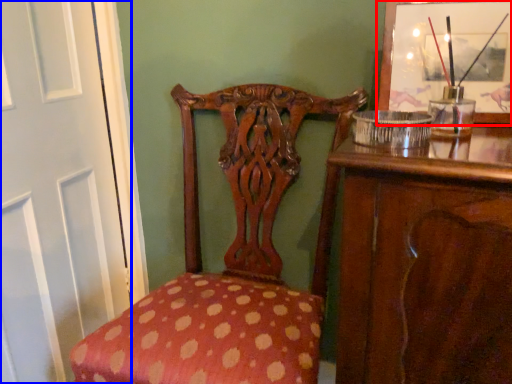
Question: Which point is closer to the camera, picture frame (highlighted by a red box) or screen door (highlighted by a blue box)?

Choices:
 (A) picture frame
 (B) screen door

Answer: (A)